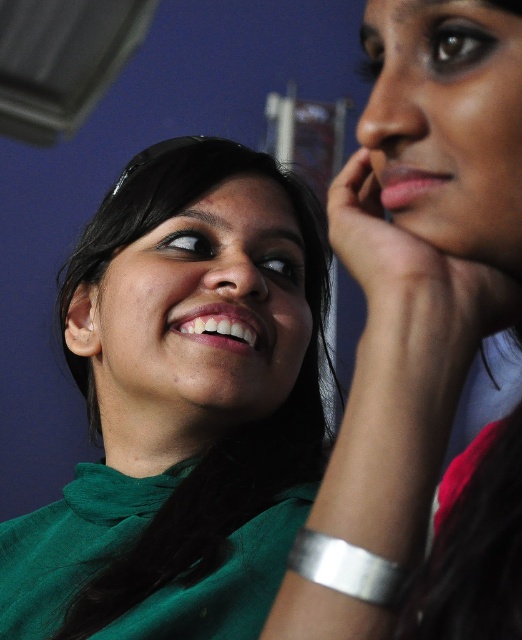
You are an artist trying to replicate this scene. You need to place the green matte shirt at center precisely on your canvas. What coordinates should you use for its position?

The green matte shirt at center should be placed at coordinates point (182, 404).

You are an artist trying to paint the scene described. You need to place a highlight on the green matte shirt at center. According to the coordinates provided, where should you place the highlight? Please specify the coordinates in the format of a point like point (182, 404).

The point (182, 404) indicates the location of the green matte shirt at center, so you should place the highlight at point (182, 404).

You are a photographer trying to capture a candid shot of the two people in the scene. The camera has a depth of field that can focus on objects within a 15 inch range. Given the distance between the green matte shirt at center and the matte skin face at upper right, will both subjects be in focus simultaneously?

The green matte shirt at center is 16.36 inches from the matte skin face at upper right. Since the camera can only focus within a 15 inch range, the distance between them exceeds this limit. Therefore, both subjects cannot be in focus at the same time.